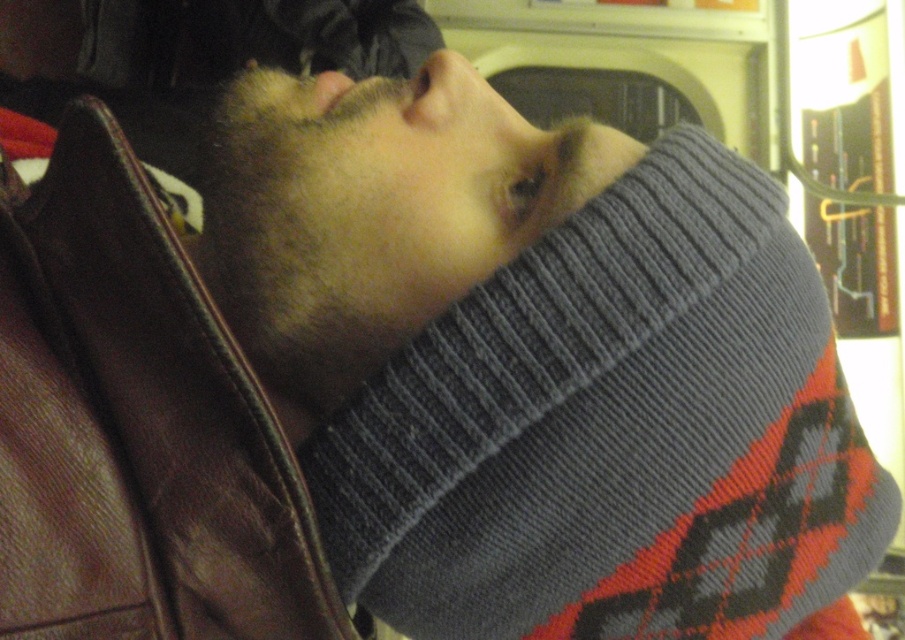
You are organizing a clothing donation drive and need to sort items by size. You have a brown leather jacket at left and a gray knitted sweater at center. Which item should you place in the small size bin?

The brown leather jacket at left has a smaller size compared to the gray knitted sweater at center, so it should be placed in the small size bin.